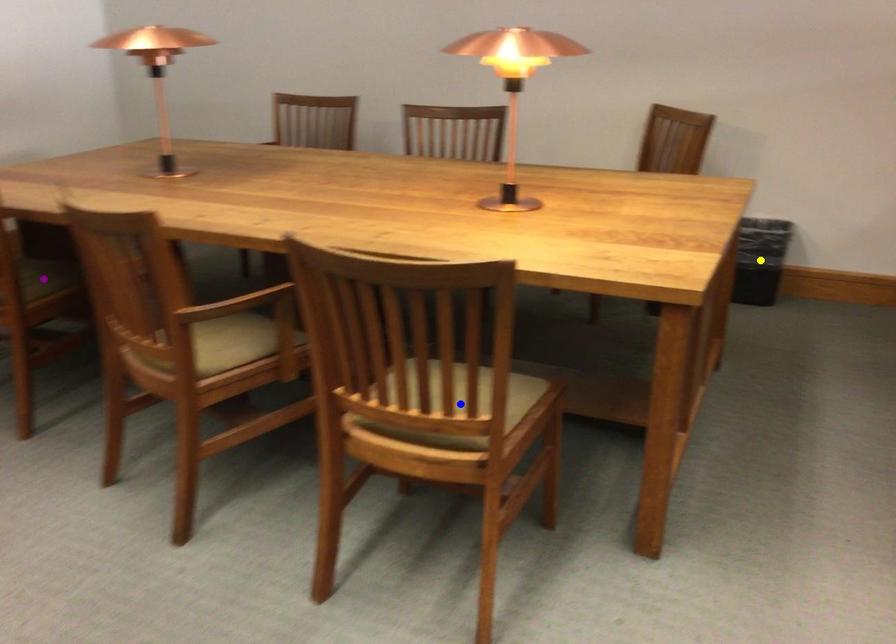
In the scene shown: Order these from nearest to farthest:
blue point | purple point | yellow point

1. blue point
2. purple point
3. yellow point